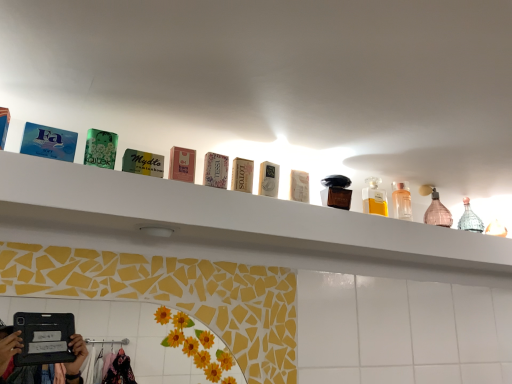
Question: From the image's perspective, is white glossy shelf at upper center located beneath matte pink soap at center, acting as the first toiletry starting from the front?

Choices:
 (A) yes
 (B) no

Answer: (A)

Question: Is white glossy shelf at upper center located outside matte pink soap at center, the first toiletry when ordered from left to right?

Choices:
 (A) yes
 (B) no

Answer: (A)

Question: Is white glossy shelf at upper center touching matte pink soap at center, acting as the first toiletry starting from the front?

Choices:
 (A) yes
 (B) no

Answer: (B)

Question: Considering the relative sizes of white glossy shelf at upper center and matte pink soap at center, acting as the first toiletry starting from the front, in the image provided, is white glossy shelf at upper center wider than matte pink soap at center, acting as the first toiletry starting from the front,?

Choices:
 (A) yes
 (B) no

Answer: (A)

Question: Is white glossy shelf at upper center far from matte pink soap at center, positioned as the 3th toiletry in back-to-front order?

Choices:
 (A) no
 (B) yes

Answer: (A)

Question: Is white glossy shelf at upper center smaller than matte pink soap at center, acting as the first toiletry starting from the front?

Choices:
 (A) yes
 (B) no

Answer: (B)

Question: Would you say white glossy shelf at upper center contains pink glass bottle at upper right, marked as the 2th mouthwash in a front-to-back arrangement?

Choices:
 (A) yes
 (B) no

Answer: (B)

Question: Is white glossy shelf at upper center touching pink glass bottle at upper right, marked as the first mouthwash in a right-to-left arrangement?

Choices:
 (A) yes
 (B) no

Answer: (B)

Question: Is white glossy shelf at upper center far from pink glass bottle at upper right, which appears as the second mouthwash when viewed from the left?

Choices:
 (A) no
 (B) yes

Answer: (A)

Question: Is white glossy shelf at upper center shorter than pink glass bottle at upper right, marked as the 2th mouthwash in a front-to-back arrangement?

Choices:
 (A) no
 (B) yes

Answer: (B)

Question: Considering the relative positions of white glossy shelf at upper center and pink glass bottle at upper right, which appears as the second mouthwash when viewed from the left, in the image provided, is white glossy shelf at upper center to the right of pink glass bottle at upper right, which appears as the second mouthwash when viewed from the left, from the viewer's perspective?

Choices:
 (A) no
 (B) yes

Answer: (A)

Question: Is white glossy shelf at upper center smaller than pink glass bottle at upper right, which appears as the first mouthwash when viewed from the back?

Choices:
 (A) no
 (B) yes

Answer: (A)

Question: Is clear glass bottle at upper right, the third toiletry in the left-to-right sequence, far away from pink glass bottle at upper right, which appears as the second mouthwash when viewed from the left?

Choices:
 (A) no
 (B) yes

Answer: (A)